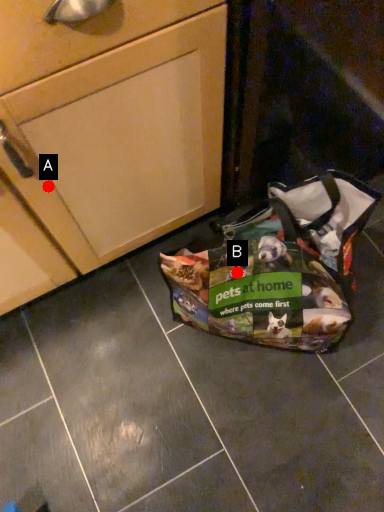
Question: Two points are circled on the image, labeled by A and B beside each circle. Which point is farther to the camera?

Choices:
 (A) A is further
 (B) B is further

Answer: (B)